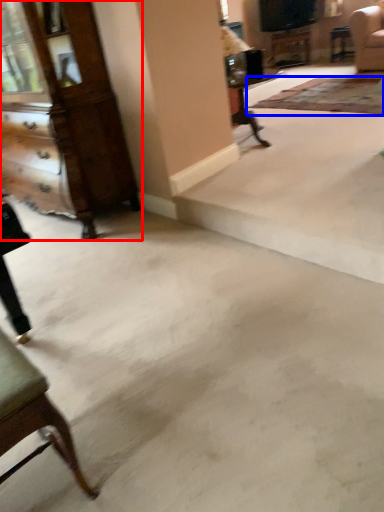
Question: Which point is closer to the camera, dresser (highlighted by a red box) or mat (highlighted by a blue box)?

Choices:
 (A) dresser
 (B) mat

Answer: (A)